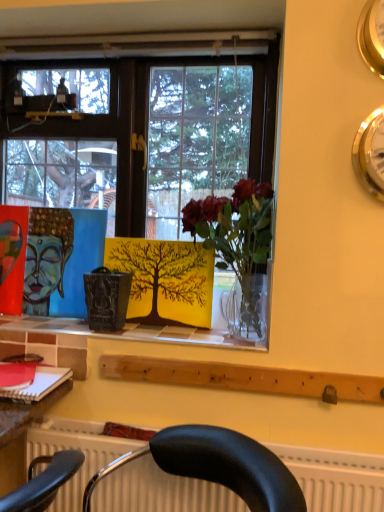
Identify the location of free spot above white tile at center (from a real-world perspective). (82, 321).